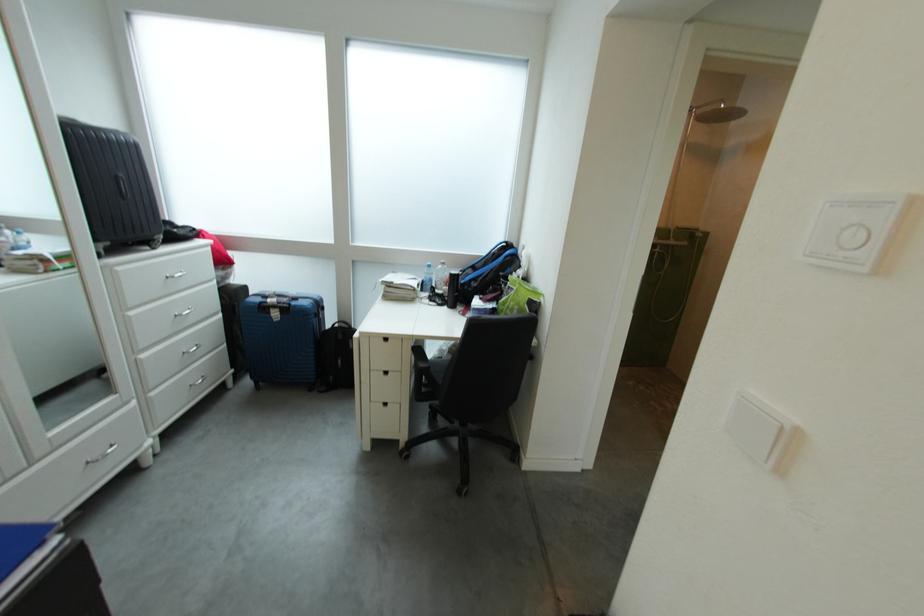
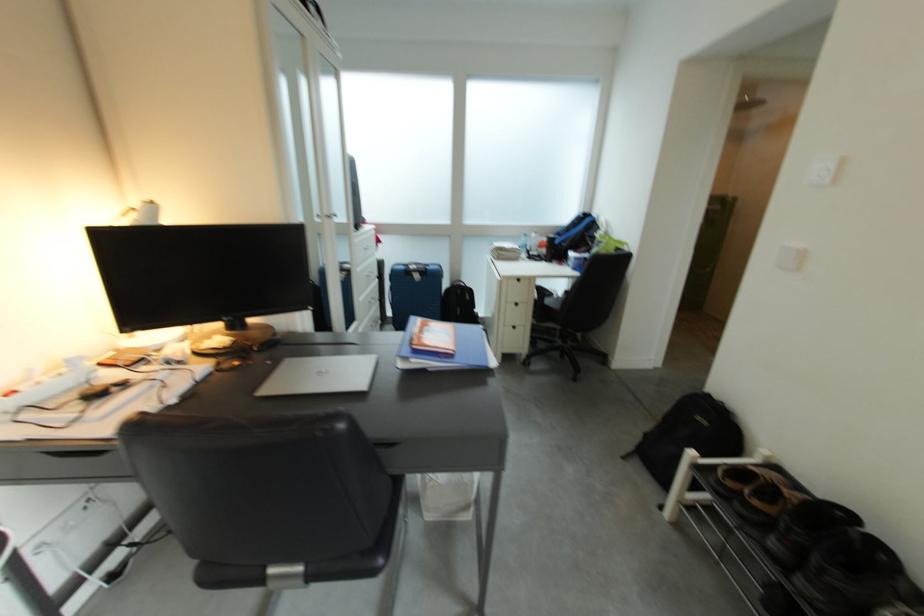
The images are taken continuously from a first-person perspective. In which direction are you moving?

The movement direction of the cameraman is left, backward.